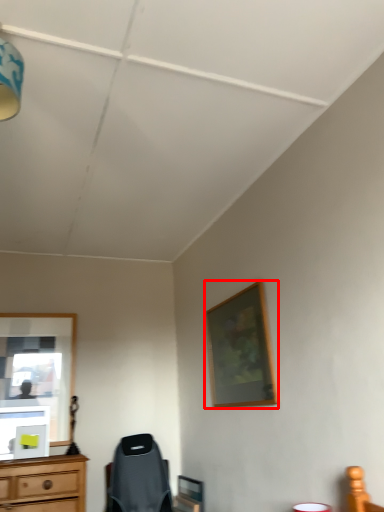
Question: From the image's perspective, what is the correct spatial positioning of picture frame (annotated by the red box) in reference to light fixture?

Choices:
 (A) above
 (B) below

Answer: (B)